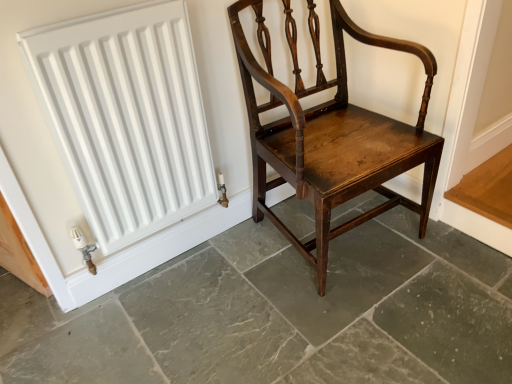
Where is `free region on the left part of shiny dark wood chair at center`? The image size is (512, 384). free region on the left part of shiny dark wood chair at center is located at coordinates (221, 285).